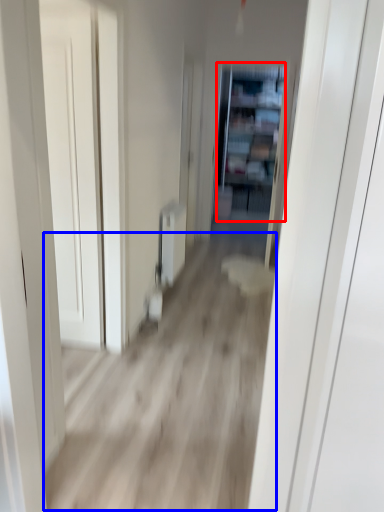
Question: Which of the following is the farthest to the observer, bookshelf (highlighted by a red box) or corridor (highlighted by a blue box)?

Choices:
 (A) bookshelf
 (B) corridor

Answer: (A)